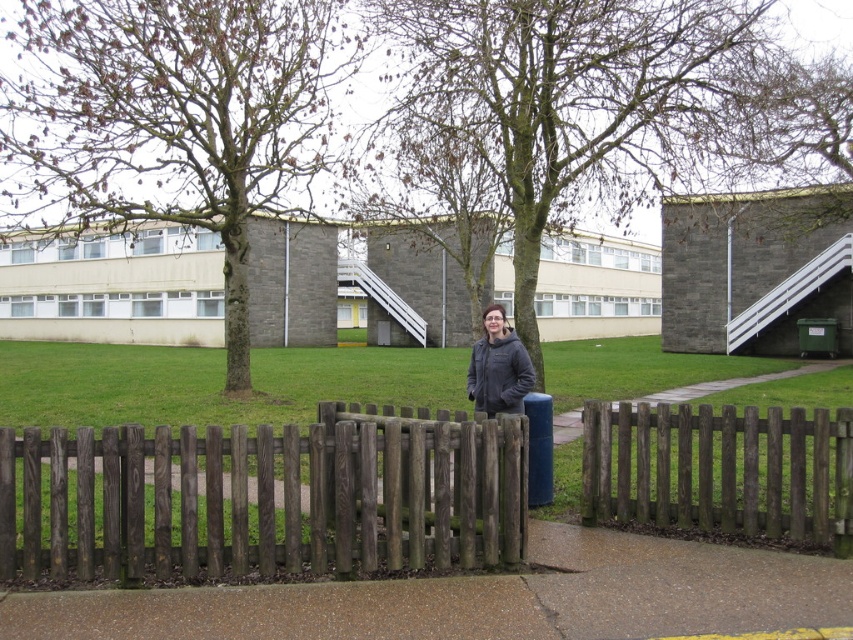
Question: Which object is positioned closest to the dark brown wooden fence at center?

Choices:
 (A) dark gray jacket at center
 (B) brown wooden fence at center
 (C) smooth concrete pavement at center

Answer: (C)

Question: Which of the following is the closest to the observer?

Choices:
 (A) (4, 493)
 (B) (814, 508)
 (C) (485, 323)
 (D) (786, 609)

Answer: (D)

Question: Is dark brown wooden fence at center further to camera compared to smooth concrete pavement at center?

Choices:
 (A) yes
 (B) no

Answer: (A)

Question: Can you confirm if smooth concrete pavement at center is positioned below brown wooden fence at center?

Choices:
 (A) yes
 (B) no

Answer: (A)

Question: Is smooth concrete pavement at center bigger than brown wooden fence at center?

Choices:
 (A) yes
 (B) no

Answer: (B)

Question: Considering the real-world distances, which object is closest to the smooth concrete pavement at center?

Choices:
 (A) dark brown wooden fence at center
 (B) brown wooden fence at center
 (C) dark gray jacket at center

Answer: (A)